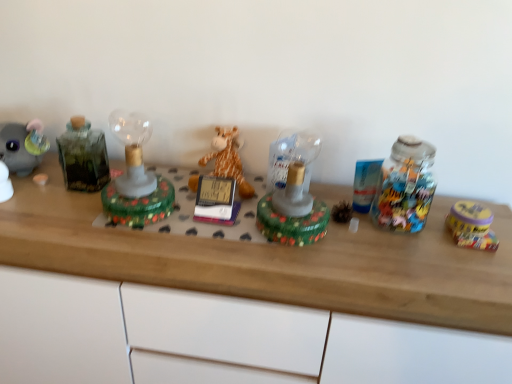
Identify the location of empty space that is to the right of translucent glass lamp at center, the 2th toy positioned from the right. (374, 251).